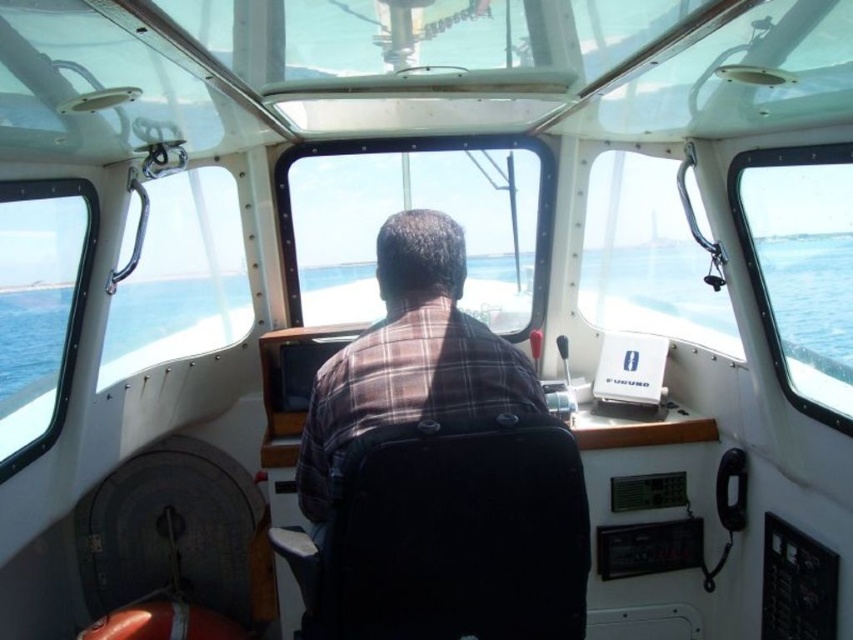
Is brown plaid shirt at center to the left of transparent glass window at right from the viewer's perspective?

Correct, you'll find brown plaid shirt at center to the left of transparent glass window at right.

Who is higher up, brown plaid shirt at center or transparent glass window at right?

transparent glass window at right is higher up.

Is point (422, 340) less distant than point (776, 260)?

That is True.

What are the coordinates of `brown plaid shirt at center` in the screenshot? It's located at (410, 356).

Can you confirm if black fabric chair at center is positioned to the right of blue water at center?

Incorrect, black fabric chair at center is not on the right side of blue water at center.

Can you confirm if black fabric chair at center is wider than blue water at center?

Incorrect, black fabric chair at center's width does not surpass blue water at center's.

Where is `black fabric chair at center`? This screenshot has height=640, width=853. black fabric chair at center is located at coordinates (450, 536).

Based on the photo, between transparent glass window at center and brown plaid shirt at center, which one appears on the left side from the viewer's perspective?

From the viewer's perspective, transparent glass window at center appears more on the left side.

Between point (491, 291) and point (395, 237), which one is positioned behind?

Point (491, 291)

Locate an element on the screen. Image resolution: width=853 pixels, height=640 pixels. transparent glass window at center is located at coordinates (415, 205).